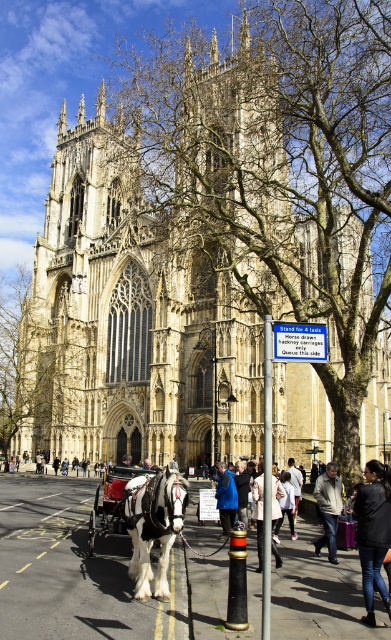
Is light beige stone church at center bigger than black leather jacket at lower right?

Yes.

Who is more distant from viewer, [170,90] or [385,596]?

Positioned behind is point [170,90].

Between point (150, 97) and point (353, 509), which one is positioned behind?

Positioned behind is point (150, 97).

Identify the location of light beige stone church at center. (218, 246).

Between black glossy horse at center and black leather jacket at lower right, which one has less height?

black glossy horse at center

Who is higher up, black glossy horse at center or black leather jacket at lower right?

black leather jacket at lower right is higher up.

What do you see at coordinates (152, 525) in the screenshot? This screenshot has width=391, height=640. I see `black glossy horse at center` at bounding box center [152, 525].

Image resolution: width=391 pixels, height=640 pixels. I want to click on black glossy horse at center, so click(152, 525).

Looking at this image, can you confirm if light beige stone church at center is shorter than black glossy horse at center?

Incorrect, light beige stone church at center's height does not fall short of black glossy horse at center's.

Who is taller, light beige stone church at center or black glossy horse at center?

light beige stone church at center is taller.

Is point (114, 300) less distant than point (136, 548)?

No, it is behind (136, 548).

Identify the location of light beige stone church at center. (218, 246).